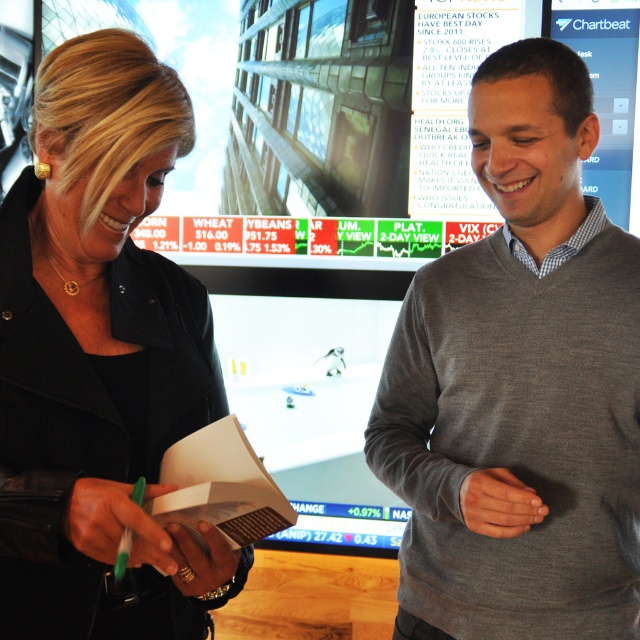
Does gray sweater at center have a lesser width compared to black matte jacket at left?

No, gray sweater at center is not thinner than black matte jacket at left.

In the scene shown: Which is below, gray sweater at center or black matte jacket at left?

gray sweater at center is lower down.

Describe the element at coordinates (518, 385) in the screenshot. Image resolution: width=640 pixels, height=640 pixels. I see `gray sweater at center` at that location.

The image size is (640, 640). I want to click on gray sweater at center, so click(518, 385).